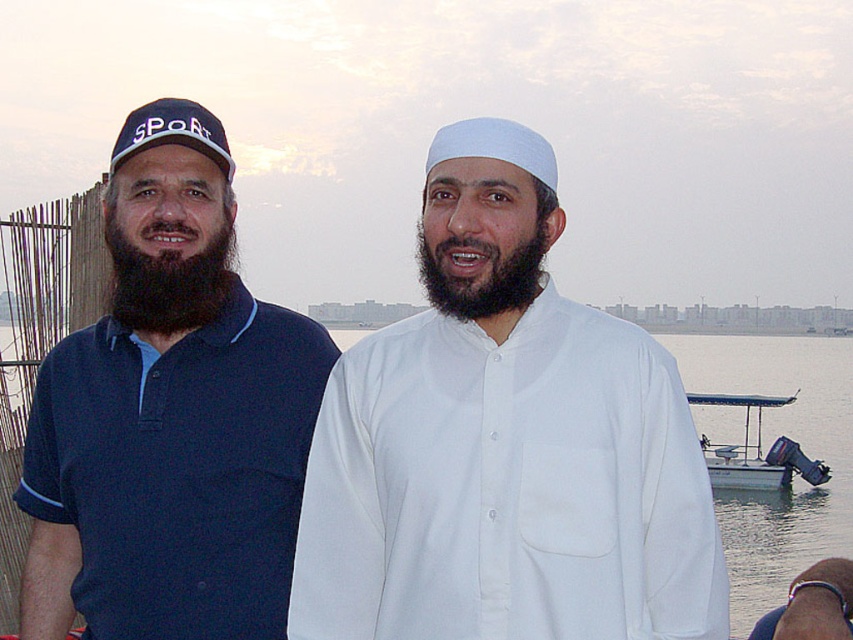
Consider the image. You are a photographer trying to capture a portrait of the two people in the scene. You want to ensure that the dark brown matte beard at center is visible above the white matte water at center in your photo. Based on their current positions, will this be possible?

Yes, because the white matte water at center is below the dark brown matte beard at center, so the beard will naturally appear above the water in the photo.

Consider the image. You are a photographer trying to capture both the white matte shirt at center and the dark brown fuzzy beard at left in a single frame. Given their sizes, which one would you need to position closer to the camera to ensure both appear equally sized in the photo?

The dark brown fuzzy beard at left is smaller in size compared to the white matte shirt at center. To make them appear equal in size in the photo, you should move the dark brown fuzzy beard at left closer to the camera since it is smaller.

You are a photographer trying to capture a closeup of the matte blue polo shirt at left. The camera you are using has a focal length of 50mm. To ensure the entire shirt fits in the frame, you need to position yourself at least 2 meters away from it. Given the shirt is 0.3 meters tall, is this distance sufficient?

The matte blue polo shirt at left is located at point (170, 416). Using the camera with a 50mm focal length, the minimum distance required to capture a 0.3m tall object in frame is calculated using the formula distance > focal length x sensor size. Assuming a full frame sensor size of 36mm, the required distance would be 50mm x 36mm. However, this calculation might not directly apply here since the shirt is part of a larger scene. Alternatively, considering the shirt occupies a portion of the image plane,